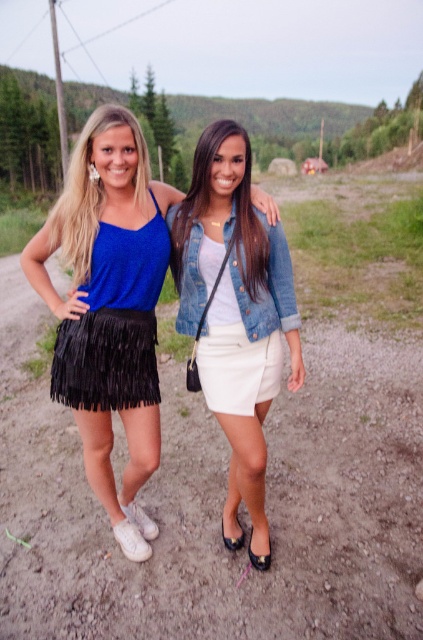
Between black fringed skirt at left and black fringe skirt at left, which one appears on the right side from the viewer's perspective?

black fringe skirt at left is more to the right.

Between point (65, 305) and point (77, 330), which one is positioned behind?

The point (65, 305) is behind.

Is point (76, 314) less distant than point (142, 314)?

Yes, it is.

At what (x,y) coordinates should I click in order to perform the action: click on black fringed skirt at left. Please return your answer as a coordinate pair (x, y). The width and height of the screenshot is (423, 640). Looking at the image, I should click on (109, 307).

Can you confirm if black fringed skirt at left is thinner than white matte skirt at center?

In fact, black fringed skirt at left might be wider than white matte skirt at center.

Which is in front, point (91, 385) or point (225, 330)?

Point (225, 330) is in front.

Find the location of `black fringed skirt at left`. black fringed skirt at left is located at coordinates (109, 307).

Can you confirm if black fringed skirt at left is positioned to the right of denim jacket at center?

No, black fringed skirt at left is not to the right of denim jacket at center.

Can you confirm if black fringed skirt at left is positioned below denim jacket at center?

Yes.

Locate an element on the screen. The image size is (423, 640). black fringed skirt at left is located at coordinates (109, 307).